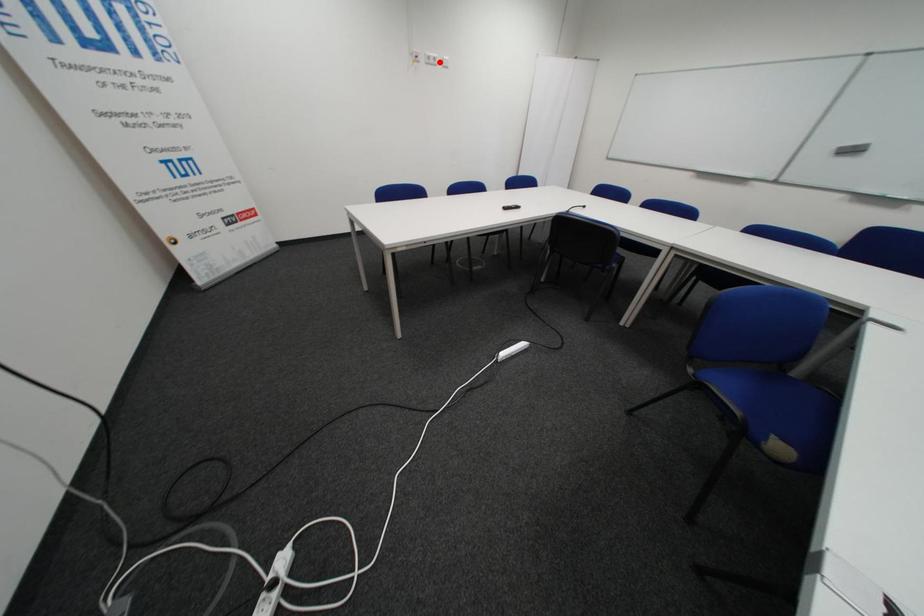
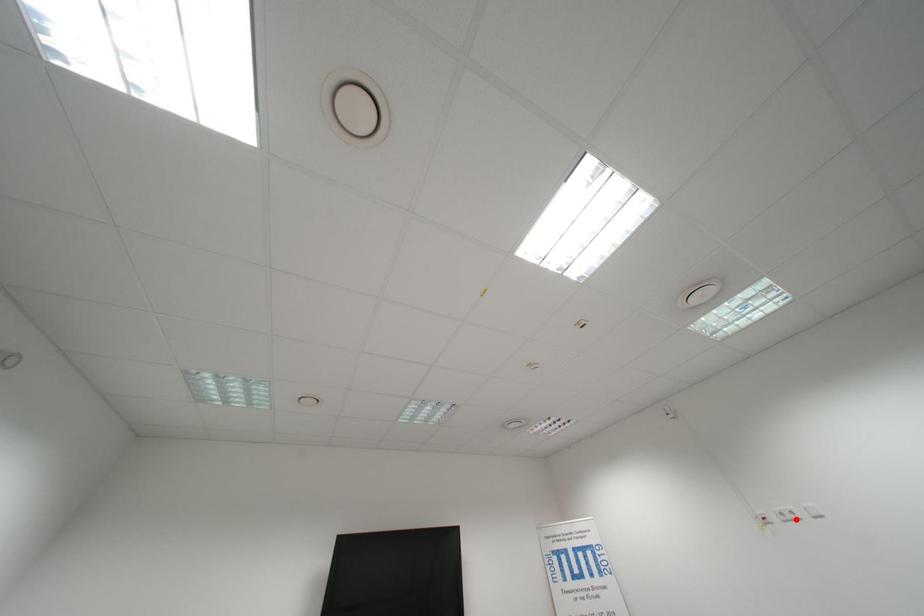
I am providing you with two images of the same scene from different viewpoints. A red point is marked on the first image and another point is marked on the second image. Do the highlighted points in image1 and image2 indicate the same real-world spot?

Yes